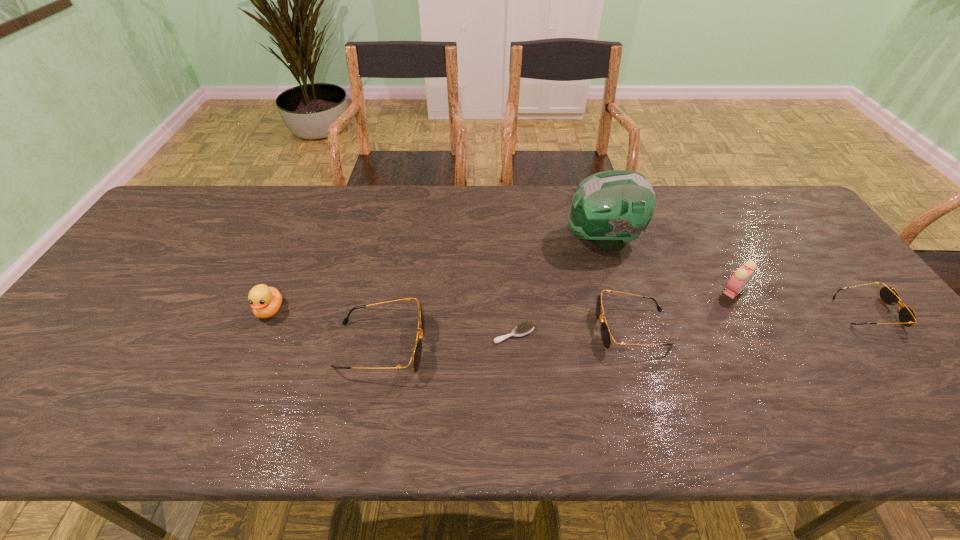
Where is `scrubbing brush`? The width and height of the screenshot is (960, 540). scrubbing brush is located at coordinates (525, 328).

Find the location of a particular element. The width and height of the screenshot is (960, 540). the shortest object is located at coordinates (525, 328).

Locate an element on the screen. This screenshot has height=540, width=960. free location located on the lenses of the tallest sunglasses is located at coordinates (519, 346).

At what (x,y) coordinates should I click in order to perform the action: click on vacant region located 0.070m on the lenses of the second shortest sunglasses. Please return your answer as a coordinate pair (x, y). Image resolution: width=960 pixels, height=540 pixels. Looking at the image, I should click on (569, 329).

At what (x,y) coordinates should I click in order to perform the action: click on vacant space situated 0.350m on the lenses of the second shortest sunglasses. Please return your answer as a coordinate pair (x, y). Looking at the image, I should click on (457, 329).

This screenshot has width=960, height=540. In order to click on vacant region located 0.330m on the lenses of the second shortest sunglasses in this screenshot , I will do `click(466, 329)`.

I want to click on free region located 0.140m on the visor of the farthest object, so click(518, 240).

The width and height of the screenshot is (960, 540). I want to click on free space located 0.220m on the visor of the farthest object, so click(x=492, y=240).

The image size is (960, 540). Identify the location of vacant space located 0.200m on the visor of the farthest object. (498, 240).

This screenshot has width=960, height=540. What are the coordinates of `free space located 0.180m on the face of the duckling` in the screenshot? It's located at 237,388.